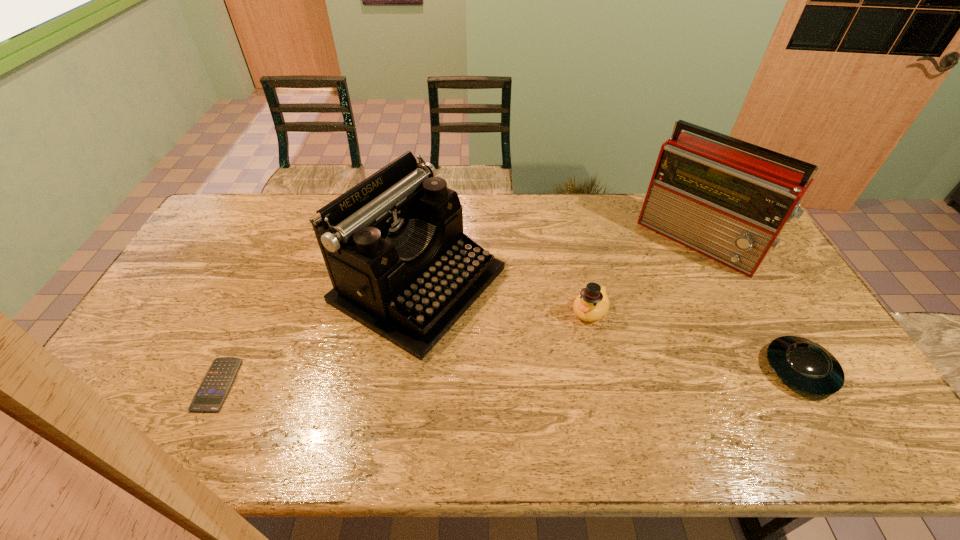
This screenshot has height=540, width=960. Find the location of `free space on the desktop that is between the leftmost object and the saucer and is positioned on the front-facing side of the radio receiver`. free space on the desktop that is between the leftmost object and the saucer and is positioned on the front-facing side of the radio receiver is located at coordinates [x=579, y=375].

Identify the location of free space on the desktop that is between the leftmost object and the second shortest object and is positioned on the front-facing side of the third object from left to right. The height and width of the screenshot is (540, 960). (534, 376).

Identify the location of free space on the desktop that is between the shortest object and the saucer and is positioned on the typing side of the typewriter. The height and width of the screenshot is (540, 960). (589, 375).